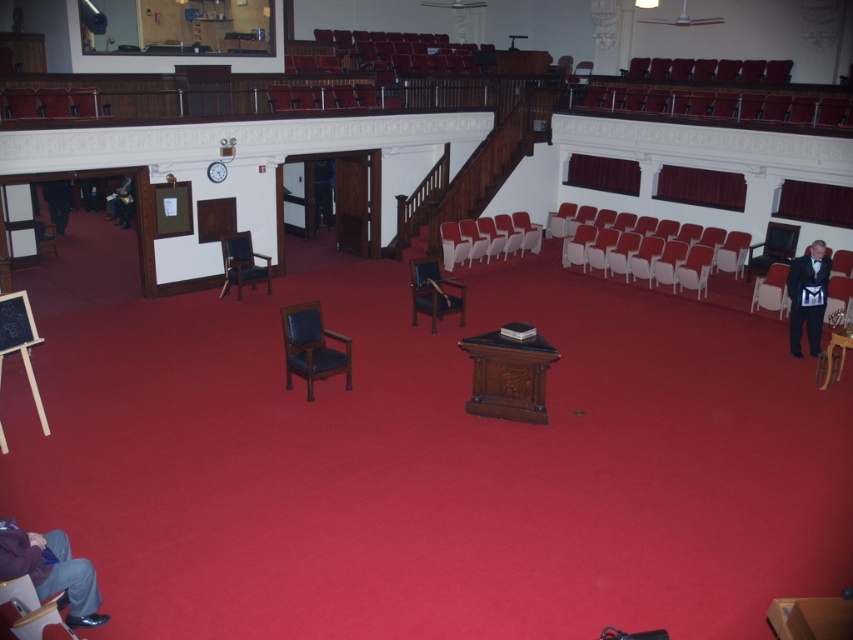
Does matte blue armchair at center appear on the left side of dark blue leather jacket at left?

In fact, matte blue armchair at center is to the right of dark blue leather jacket at left.

From the picture: Does matte blue armchair at center appear over dark blue leather jacket at left?

Incorrect, matte blue armchair at center is not positioned above dark blue leather jacket at left.

Between point (434, 280) and point (119, 196), which one is positioned behind?

The point (119, 196) is behind.

This screenshot has height=640, width=853. In order to click on matte blue armchair at center in this screenshot , I will do `click(434, 292)`.

Does point (67, 556) come in front of point (425, 260)?

Yes.

Identify the location of denim pants at lower left. This screenshot has height=640, width=853. (51, 572).

Is leather wood armchair at center positioned at the back of velvet dark blue armchair at right?

No, it is not.

How far apart are leather wood armchair at center and velvet dark blue armchair at right?

leather wood armchair at center is 24.67 feet from velvet dark blue armchair at right.

Find the location of a particular element. The height and width of the screenshot is (640, 853). leather wood armchair at center is located at coordinates (312, 346).

Identify the location of leather wood armchair at center. The width and height of the screenshot is (853, 640). (312, 346).